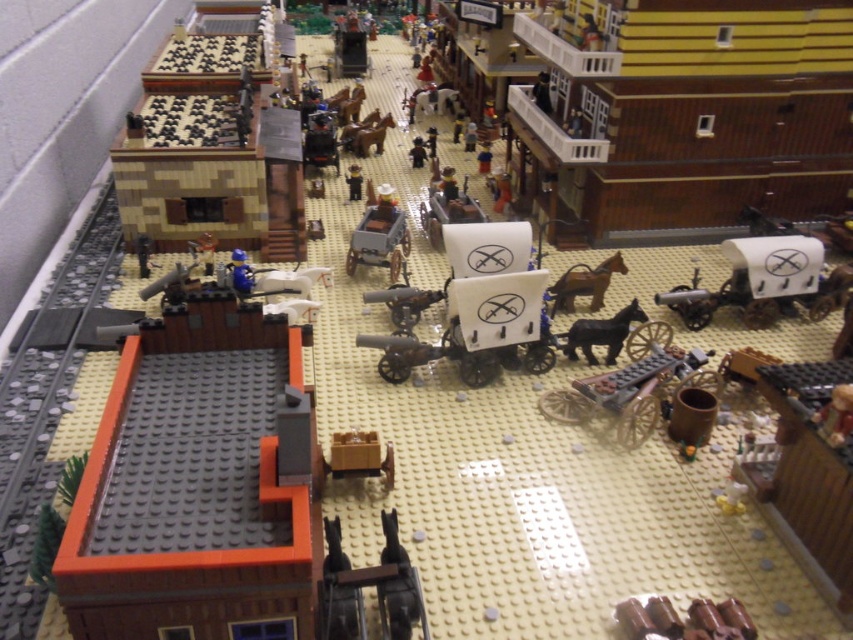
Between brown matte wagon at center-right and matte gray wagon at center, which one has less height?

With less height is brown matte wagon at center-right.

Can you confirm if brown matte wagon at center-right is taller than matte gray wagon at center?

No.

Between point (584, 397) and point (349, 246), which one is positioned behind?

The point (349, 246) is more distant.

Find the location of `brown matte wagon at center-right`. brown matte wagon at center-right is located at coordinates (624, 394).

Is blue plastic figure at center-left bigger than brown matte figure at center?

Yes, blue plastic figure at center-left is bigger than brown matte figure at center.

The width and height of the screenshot is (853, 640). Identify the location of blue plastic figure at center-left. (241, 273).

I want to click on blue plastic figure at center-left, so click(241, 273).

Locate an element on the screen. Image resolution: width=853 pixels, height=640 pixels. blue plastic figure at center-left is located at coordinates (241, 273).

Is matte gray wagon at center to the left of black matte horse at center-right from the viewer's perspective?

Indeed, matte gray wagon at center is positioned on the left side of black matte horse at center-right.

Which is above, matte gray wagon at center or black matte horse at center-right?

Positioned higher is matte gray wagon at center.

Measure the distance between point [350,241] and camera.

A distance of 6.67 feet exists between point [350,241] and camera.

The image size is (853, 640). In order to click on matte gray wagon at center in this screenshot , I will do `click(379, 241)`.